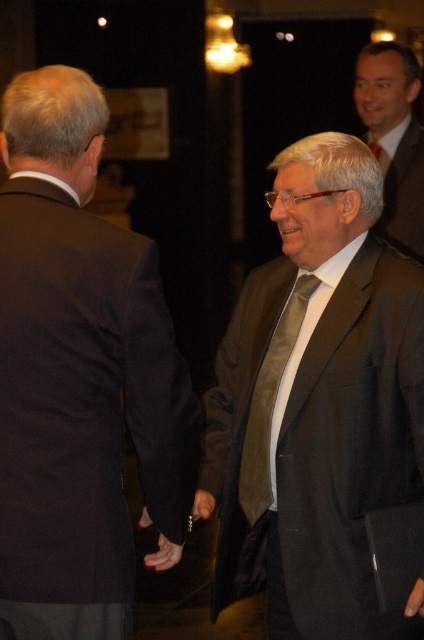
Question: Which of the following is the closest to the observer?

Choices:
 (A) (41, 278)
 (B) (201, 493)
 (C) (250, 476)
 (D) (407, 172)

Answer: (A)

Question: Does dark brown suit at left lie in front of matte brown suit at upper right?

Choices:
 (A) yes
 (B) no

Answer: (A)

Question: Among these points, which one is farthest from the camera?

Choices:
 (A) (31, 252)
 (B) (259, 513)
 (C) (407, 205)
 (D) (376, 496)

Answer: (C)

Question: Observing the image, what is the correct spatial positioning of dark brown suit at left in reference to matte brown suit at center?

Choices:
 (A) left
 (B) right

Answer: (A)

Question: Does dark brown suit at left come behind matte brown suit at center?

Choices:
 (A) yes
 (B) no

Answer: (B)

Question: Which point appears farthest from the camera in this image?

Choices:
 (A) (97, 531)
 (B) (256, 445)

Answer: (B)